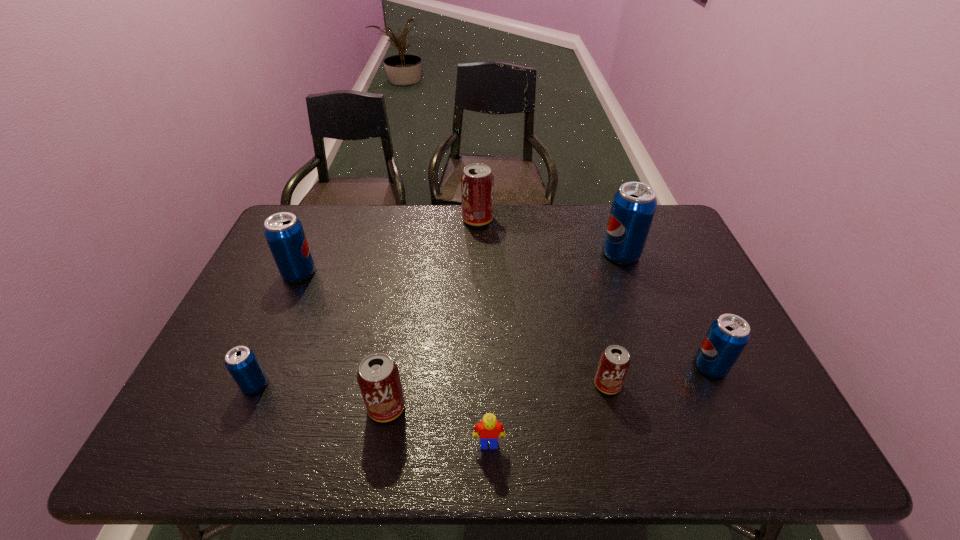
You are a GUI agent. You are given a task and a screenshot of the screen. Output one action in this format:
    pyautogui.click(x=<x>, y=<y>)
    Task: Click on the vacant area that lies between the sixth object from right to left and the third object from right to left
    The image size is (960, 540).
    Given the screenshot: What is the action you would take?
    (x=497, y=396)

Identify the location of free spot between the smallest red soda can and the third smallest blue pop soda. The image size is (960, 540). (453, 328).

Locate an element on the screen. This screenshot has width=960, height=540. empty space between the tallest soda can and the fifth soda can from right to left is located at coordinates (504, 330).

Identify the location of vacant area that lies between the rightmost blue pop soda and the smallest blue pop soda. (483, 375).

The width and height of the screenshot is (960, 540). Find the location of `empty space between the biggest blue pop soda and the rightmost blue pop soda`. empty space between the biggest blue pop soda and the rightmost blue pop soda is located at coordinates (665, 309).

The height and width of the screenshot is (540, 960). I want to click on free space that is in between the smallest blue pop soda and the farthest object, so click(x=366, y=302).

Locate an element on the screen. free space that is in between the sixth object from right to left and the second smallest blue pop soda is located at coordinates (548, 387).

The width and height of the screenshot is (960, 540). What are the coordinates of `vacant area between the rightmost blue pop soda and the smallest blue pop soda` in the screenshot? It's located at (483, 375).

Where is `free point between the third smallest blue pop soda and the third object from left to right`? free point between the third smallest blue pop soda and the third object from left to right is located at coordinates click(x=343, y=340).

Image resolution: width=960 pixels, height=540 pixels. Identify the location of object that can be found as the fourth closest to the tallest object. (489, 429).